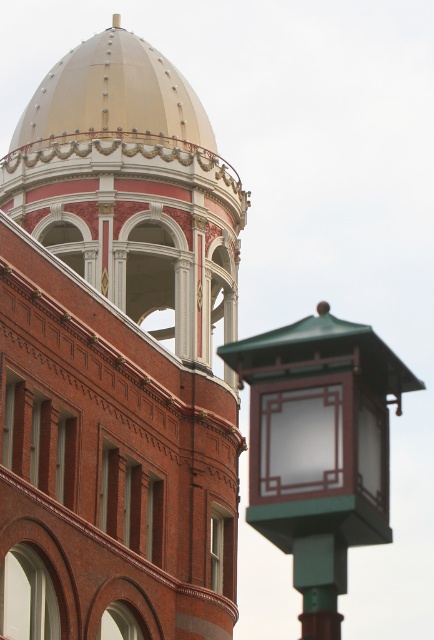
Question: Does brick tower at center have a smaller size compared to green glass lantern at right?

Choices:
 (A) yes
 (B) no

Answer: (B)

Question: Which object is closer to the camera taking this photo?

Choices:
 (A) brick tower at center
 (B) green glass lantern at right

Answer: (B)

Question: Is brick tower at center wider than green glass lantern at right?

Choices:
 (A) yes
 (B) no

Answer: (A)

Question: Which object is positioned closest to the gold metallic dome at upper center?

Choices:
 (A) green glass lantern at right
 (B) brick tower at center

Answer: (B)

Question: Which point appears farthest from the camera in this image?

Choices:
 (A) (48, 96)
 (B) (364, 339)

Answer: (A)

Question: Is brick tower at center closer to camera compared to gold metallic dome at upper center?

Choices:
 (A) yes
 (B) no

Answer: (A)